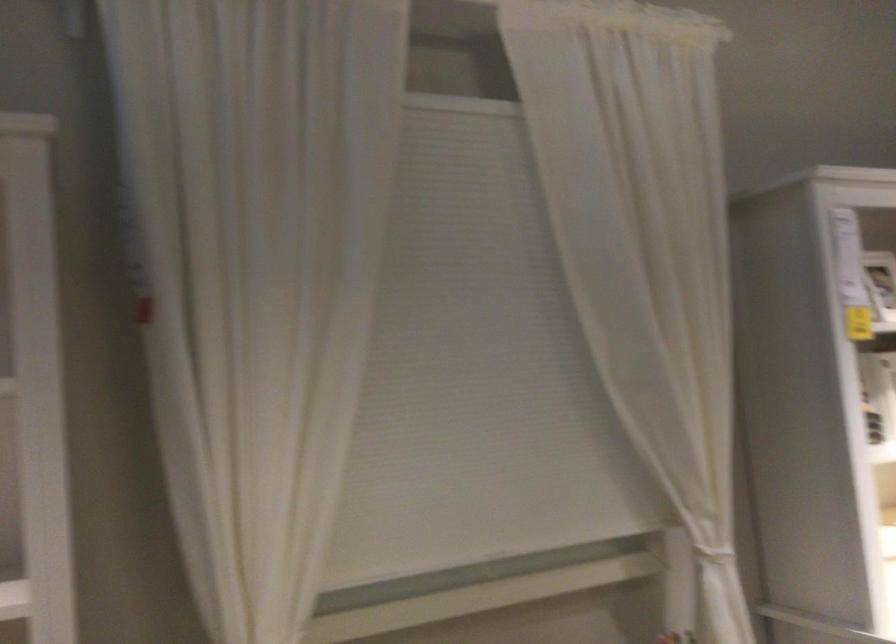
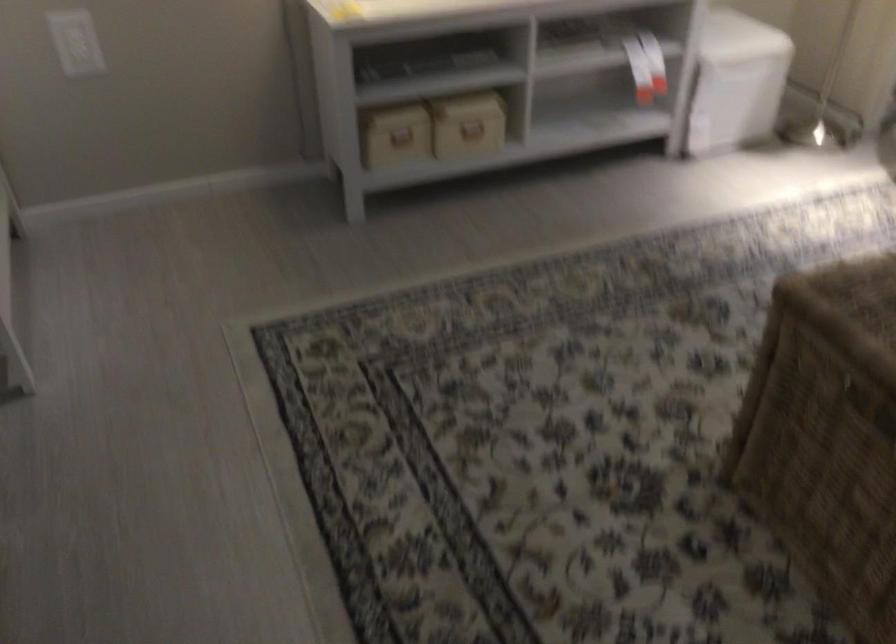
First-person continuous shooting, in which direction is the camera rotating?

The camera's rotation is toward right-down.